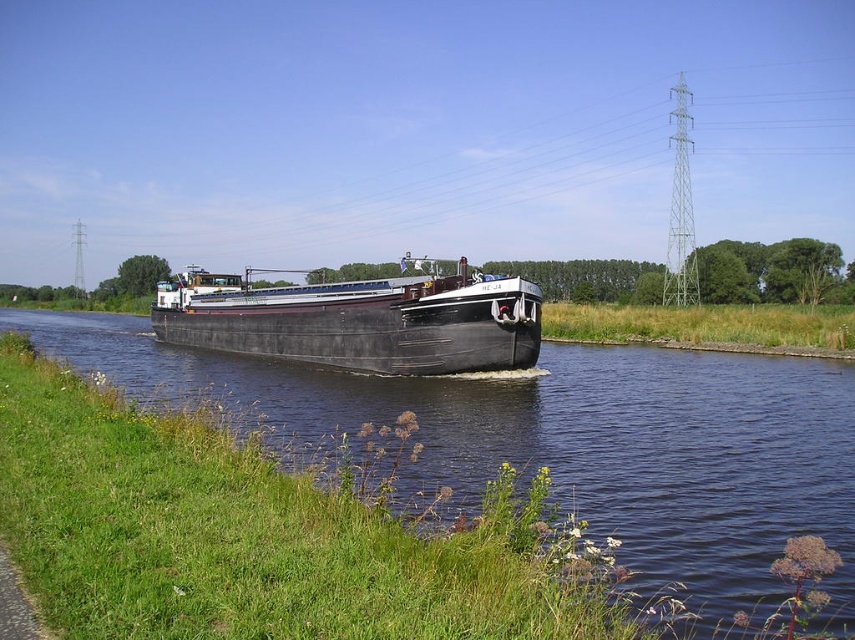
You are standing at the point with coordinates (563, 440) in the canal scene. What object is exactly at your current location?

The black rubber boat at center is located at point (563, 440).

You are a photographer wanting to capture the black rubber boat at center and the matte black barge at center in the same frame. Which object will appear taller in your photo?

The matte black barge at center will appear taller in the photo since it has a greater height than the black rubber boat at center.

You are a photographer standing on the grassy bank on the left side of the canal. You want to take a picture of the black rubber boat at center and the matte black barge at center. Which object will appear closer to you in the photo?

The black rubber boat at center will appear closer to you in the photo because it is positioned in front of the matte black barge at center.